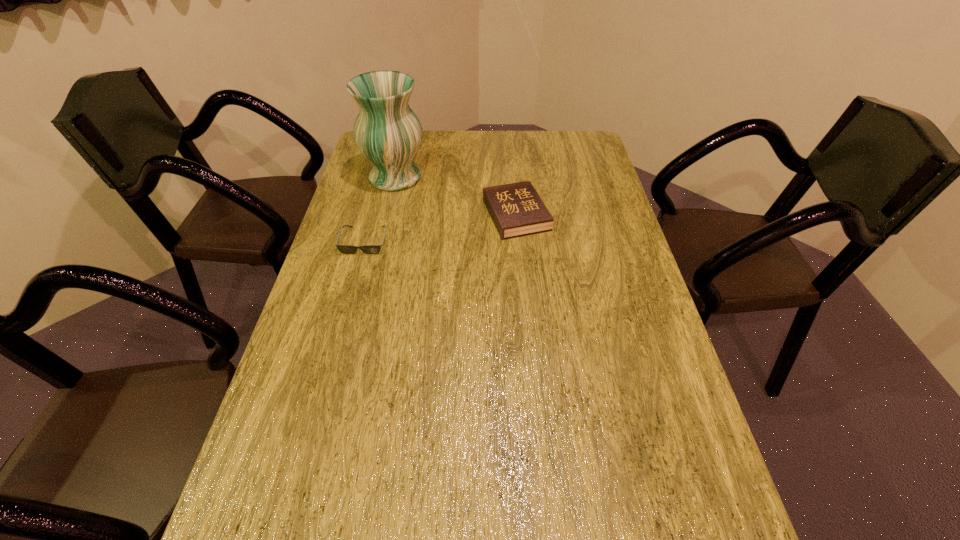
This screenshot has width=960, height=540. What are the coordinates of `object identified as the closest to the vase` in the screenshot? It's located at (345, 249).